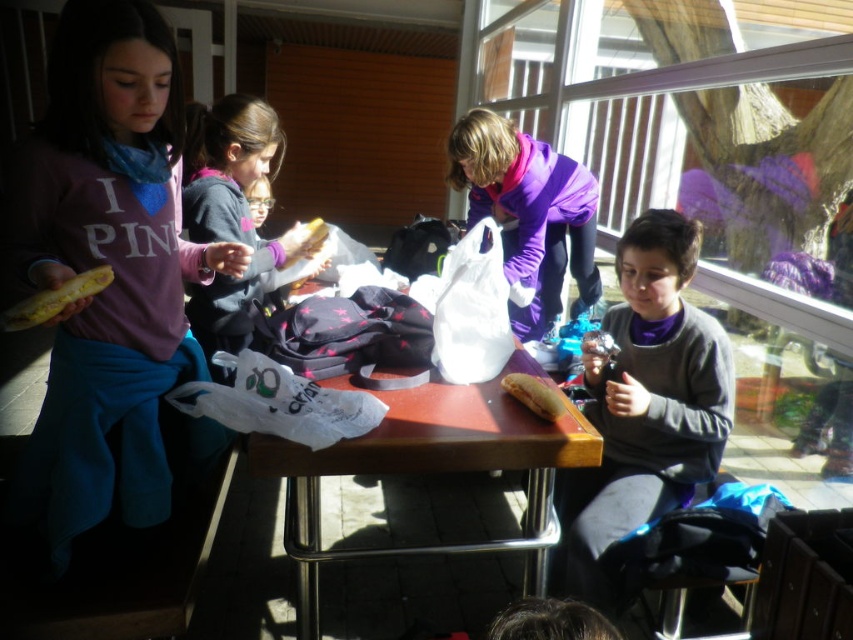
Question: In this image, where is matte purple sweatshirt at left located relative to purple fleece jacket at upper center?

Choices:
 (A) below
 (B) above

Answer: (A)

Question: Is matte purple sweatshirt at left bigger than yellow matte sandwich at center?

Choices:
 (A) no
 (B) yes

Answer: (B)

Question: Which object appears farthest from the camera in this image?

Choices:
 (A) matte purple sweatshirt at left
 (B) wooden table at center
 (C) yellow bread at center
 (D) yellow matte sandwich at center

Answer: (C)

Question: Estimate the real-world distances between objects in this image. Which object is farther from the yellow bread at center?

Choices:
 (A) yellow matte sandwich at left
 (B) yellow matte sandwich at center
 (C) purple fleece jacket at upper center
 (D) matte purple sweatshirt at left

Answer: (A)

Question: Can you confirm if wooden table at center is positioned below yellow matte sandwich at center?

Choices:
 (A) no
 (B) yes

Answer: (B)

Question: Based on their relative distances, which object is farther from the wooden table at center?

Choices:
 (A) matte purple sweatshirt at left
 (B) gray matte sweater at center
 (C) yellow matte sandwich at center
 (D) yellow bread at center

Answer: (D)